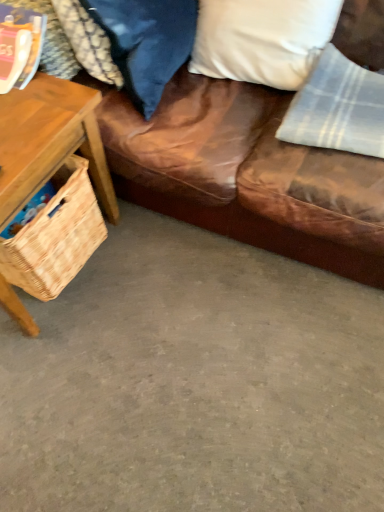
Question: Is velvet blue pillow at upper center, which is counted as the second pillow, starting from the right, facing towards woven wood basket at left?

Choices:
 (A) yes
 (B) no

Answer: (B)

Question: Is velvet blue pillow at upper center, which is counted as the second pillow, starting from the right, smaller than woven wood basket at left?

Choices:
 (A) no
 (B) yes

Answer: (B)

Question: Can you confirm if velvet blue pillow at upper center, which is counted as the second pillow, starting from the right, is thinner than woven wood basket at left?

Choices:
 (A) yes
 (B) no

Answer: (A)

Question: Is velvet blue pillow at upper center, placed as the 1th pillow when sorted from left to right, wider than woven wood basket at left?

Choices:
 (A) yes
 (B) no

Answer: (B)

Question: From a real-world perspective, is velvet blue pillow at upper center, placed as the 1th pillow when sorted from left to right, under woven wood basket at left?

Choices:
 (A) yes
 (B) no

Answer: (B)

Question: Is gray concrete floor at lower center bigger or smaller than brown leather couch at upper right?

Choices:
 (A) big
 (B) small

Answer: (B)

Question: Based on their positions, is gray concrete floor at lower center located to the left or right of brown leather couch at upper right?

Choices:
 (A) left
 (B) right

Answer: (A)

Question: From the image's perspective, is gray concrete floor at lower center positioned above or below brown leather couch at upper right?

Choices:
 (A) above
 (B) below

Answer: (B)

Question: Relative to brown leather couch at upper right, is gray concrete floor at lower center in front or behind?

Choices:
 (A) front
 (B) behind

Answer: (B)

Question: From the image's perspective, is woven wood basket at left positioned above or below velvet blue pillow at upper center, which is counted as the second pillow, starting from the right?

Choices:
 (A) below
 (B) above

Answer: (A)

Question: Considering their positions, is woven wood basket at left located in front of or behind velvet blue pillow at upper center, which is counted as the second pillow, starting from the right?

Choices:
 (A) front
 (B) behind

Answer: (A)

Question: Is point (44, 108) positioned closer to the camera than point (155, 98)?

Choices:
 (A) closer
 (B) farther

Answer: (A)

Question: Looking at the image, does woven wood basket at left seem bigger or smaller compared to velvet blue pillow at upper center, placed as the 1th pillow when sorted from left to right?

Choices:
 (A) big
 (B) small

Answer: (A)

Question: Is velvet blue pillow at upper center, which is counted as the second pillow, starting from the right, taller or shorter than gray concrete floor at lower center?

Choices:
 (A) tall
 (B) short

Answer: (A)

Question: In terms of width, does velvet blue pillow at upper center, which is counted as the second pillow, starting from the right, look wider or thinner when compared to gray concrete floor at lower center?

Choices:
 (A) thin
 (B) wide

Answer: (A)